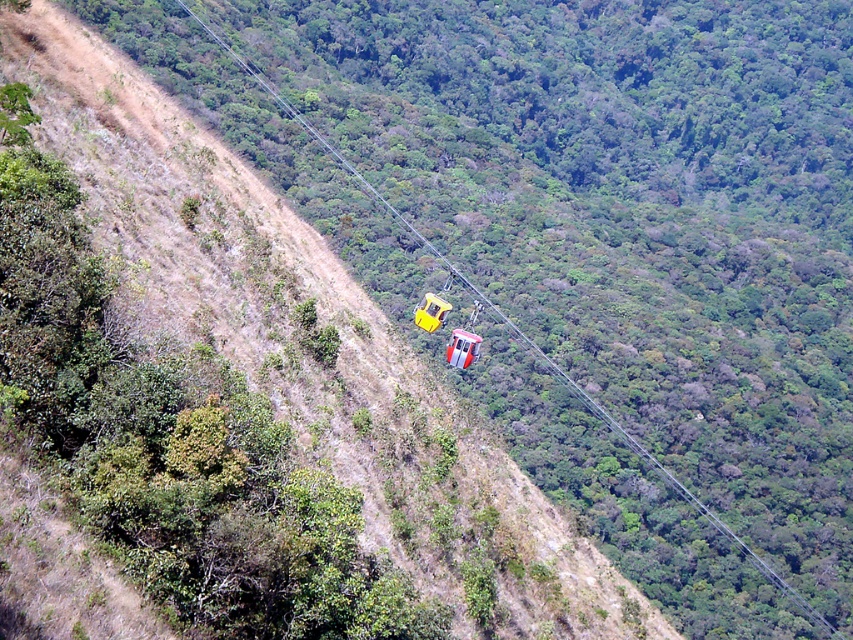
Question: Can you confirm if yellow matte parachute at center is wider than yellow matte cable car at center?

Choices:
 (A) yes
 (B) no

Answer: (B)

Question: Which of the following is the farthest from the observer?

Choices:
 (A) (422, 308)
 (B) (473, 356)

Answer: (A)

Question: Is yellow matte parachute at center behind yellow matte cable car at center?

Choices:
 (A) no
 (B) yes

Answer: (A)

Question: Is yellow matte parachute at center above yellow matte cable car at center?

Choices:
 (A) yes
 (B) no

Answer: (B)

Question: Which point is farther to the camera?

Choices:
 (A) (445, 355)
 (B) (424, 317)

Answer: (A)